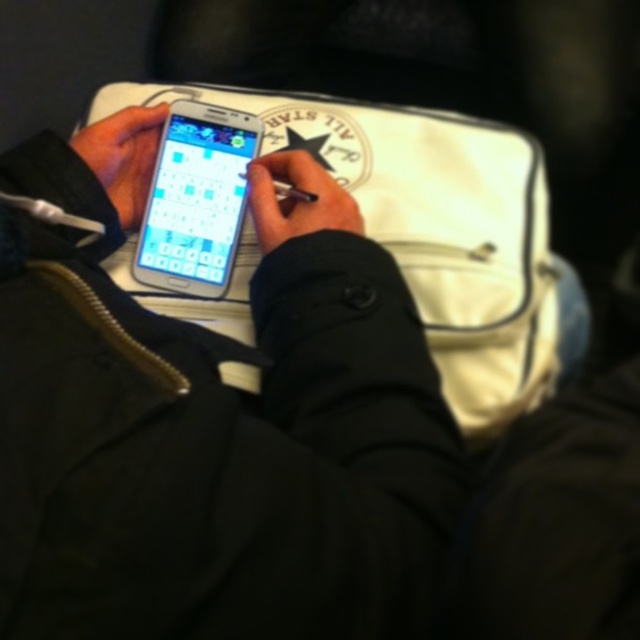
Question: Among these points, which one is nearest to the camera?

Choices:
 (A) (339, 193)
 (B) (464, 163)
 (C) (132, 216)
 (D) (140, 264)

Answer: (A)

Question: Is black matte phone at center positioned in front of black matte pen at center?

Choices:
 (A) no
 (B) yes

Answer: (B)

Question: Which of the following is the closest to the observer?

Choices:
 (A) matte black smartphone at center
 (B) black matte phone at center
 (C) white fabric bag at center
 (D) matte black phone at left

Answer: (B)

Question: Does black matte phone at center have a smaller size compared to white fabric bag at center?

Choices:
 (A) yes
 (B) no

Answer: (B)

Question: Which object is closer to the camera taking this photo?

Choices:
 (A) matte black smartphone at center
 (B) matte black phone at left
 (C) black matte pen at center
 (D) black matte phone at center

Answer: (D)

Question: Does black matte phone at center have a larger size compared to black matte pen at center?

Choices:
 (A) no
 (B) yes

Answer: (B)